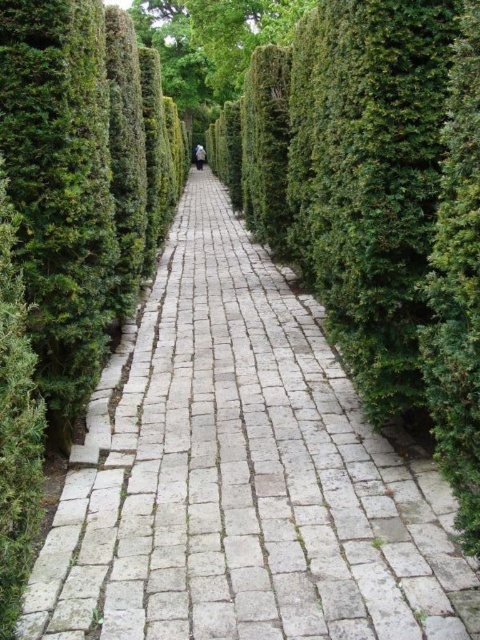
Question: Considering the relative positions of white stone pavement at center and green textured hedge at upper center in the image provided, where is white stone pavement at center located with respect to green textured hedge at upper center?

Choices:
 (A) right
 (B) left

Answer: (A)

Question: Does white stone pavement at center appear on the right side of green textured hedge at upper center?

Choices:
 (A) no
 (B) yes

Answer: (B)

Question: Does white stone pavement at center have a larger size compared to green textured hedge at upper center?

Choices:
 (A) yes
 (B) no

Answer: (A)

Question: Which point is farther to the camera?

Choices:
 (A) green textured hedge at upper center
 (B) white stone pavement at center

Answer: (A)